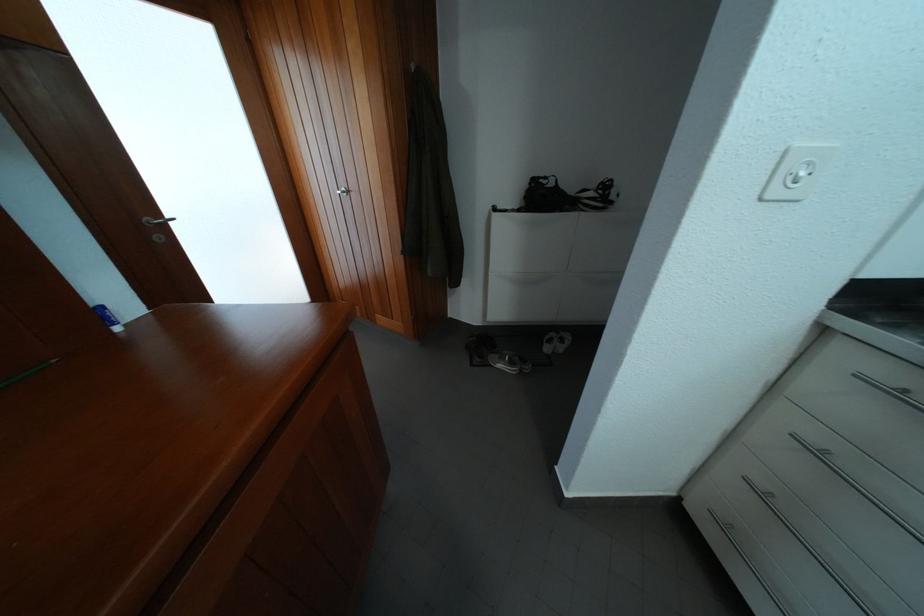
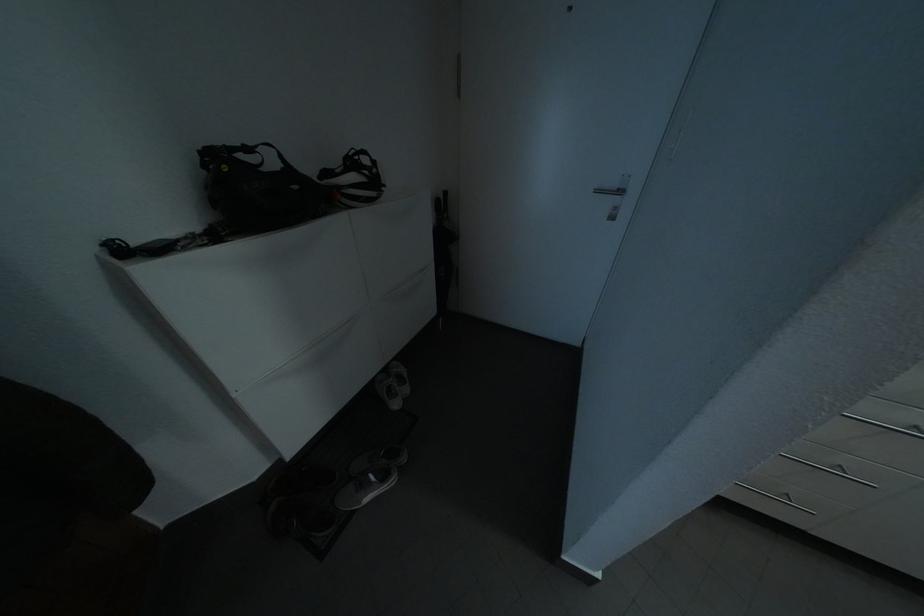
In the second image, find the point that corresponds to point (521, 369) in the first image.

(393, 483)